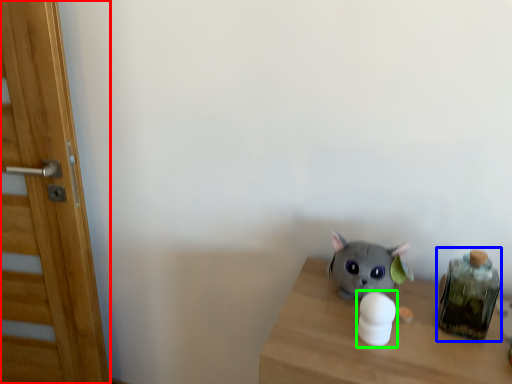
Question: Which object is positioned farthest from door (highlighted by a red box)? Select from glass jar (highlighted by a blue box) and toy (highlighted by a green box).

Choices:
 (A) glass jar
 (B) toy

Answer: (A)